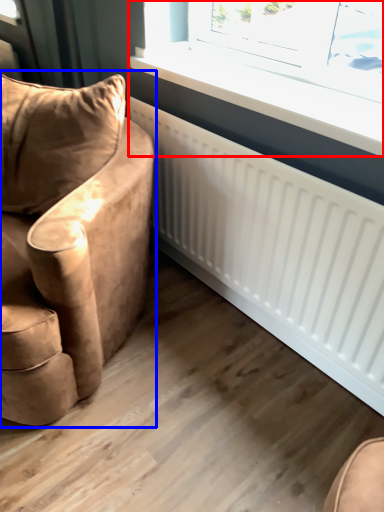
Question: Which of the following is the closest to the observer, window (highlighted by a red box) or chair (highlighted by a blue box)?

Choices:
 (A) window
 (B) chair

Answer: (B)